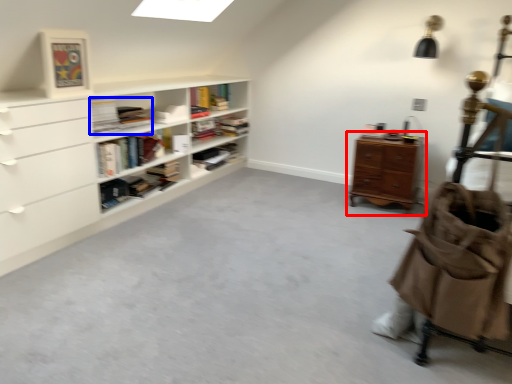
Question: Which point is further to the camera, chest of drawers (highlighted by a red box) or book (highlighted by a blue box)?

Choices:
 (A) chest of drawers
 (B) book

Answer: (A)